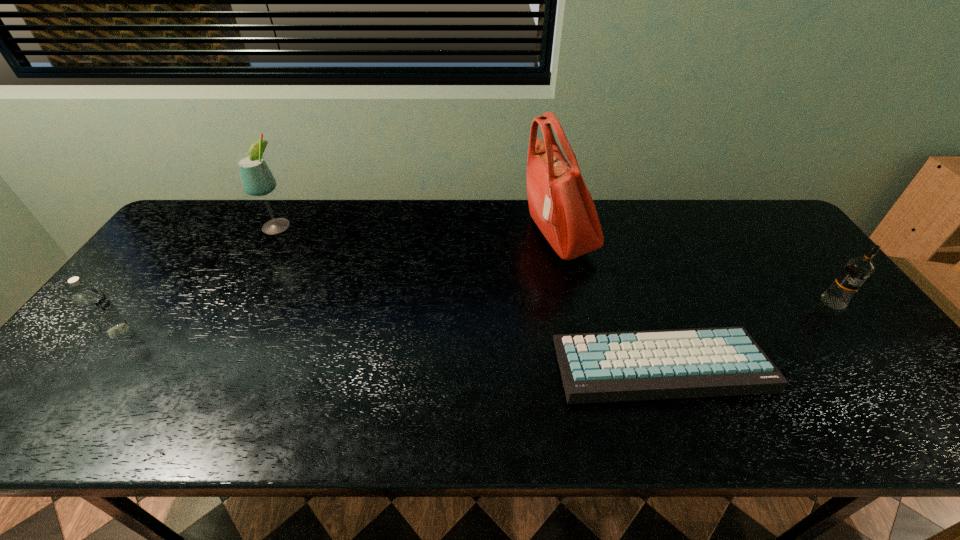
Locate an element on the screen. empty space between the handbag and the fourth object from right to left is located at coordinates pyautogui.click(x=418, y=231).

This screenshot has height=540, width=960. What are the coordinates of `free area in between the fourth object from right to left and the rightmost object` in the screenshot? It's located at (555, 264).

At what (x,y) coordinates should I click in order to perform the action: click on free space that is in between the left vodka and the second tallest object. Please return your answer as a coordinate pair (x, y). This screenshot has width=960, height=540. Looking at the image, I should click on (198, 278).

Where is `unoccupied position between the alcohol and the tallest object`? unoccupied position between the alcohol and the tallest object is located at coordinates (418, 231).

The height and width of the screenshot is (540, 960). I want to click on object that is the fourth closest to the farther vodka, so click(x=94, y=304).

Find the location of a particular element. This screenshot has width=960, height=540. object that is the closest to the tallest object is located at coordinates (726, 361).

Where is `vacant space that satisfies the following two spatial constraints: 1. on the front label of the nearer vodka; 2. on the left side of the shortest object`? Image resolution: width=960 pixels, height=540 pixels. vacant space that satisfies the following two spatial constraints: 1. on the front label of the nearer vodka; 2. on the left side of the shortest object is located at coordinates (93, 364).

The width and height of the screenshot is (960, 540). Identify the location of free spot that satisfies the following two spatial constraints: 1. on the label of the rightmost object; 2. on the front label of the left vodka. (855, 331).